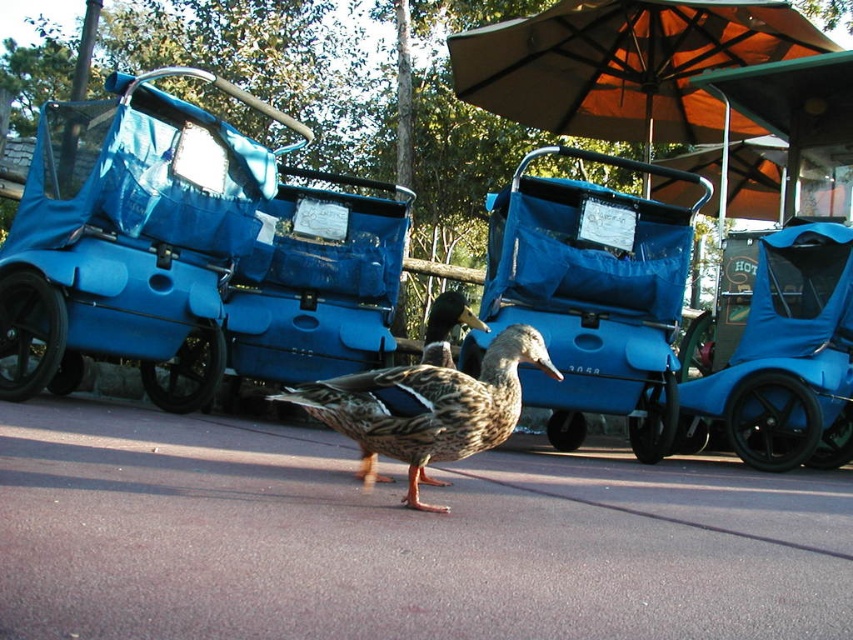
Question: Estimate the real-world distances between objects in this image. Which object is farther from the brown speckled feathers at center?

Choices:
 (A) brown asphalt at center
 (B) blue fabric carriage at left
 (C) blue matte golf cart at center

Answer: (B)

Question: Is brown fabric umbrella at upper center in front of brown speckled feathers at center?

Choices:
 (A) yes
 (B) no

Answer: (B)

Question: Estimate the real-world distances between objects in this image. Which object is closer to the blue fabric carriage at left?

Choices:
 (A) brown fabric umbrella at upper center
 (B) brown asphalt at center
 (C) blue matte golf cart at center
 (D) brown speckled feathers at center

Answer: (B)

Question: Which of the following is the closest to the observer?

Choices:
 (A) pyautogui.click(x=486, y=397)
 (B) pyautogui.click(x=775, y=412)
 (C) pyautogui.click(x=485, y=464)
 (D) pyautogui.click(x=100, y=289)

Answer: (A)

Question: Is blue fabric carriage at left positioned in front of blue matte golf cart at center?

Choices:
 (A) no
 (B) yes

Answer: (B)

Question: Is brown asphalt at center bigger than brown speckled feathers at center?

Choices:
 (A) no
 (B) yes

Answer: (B)